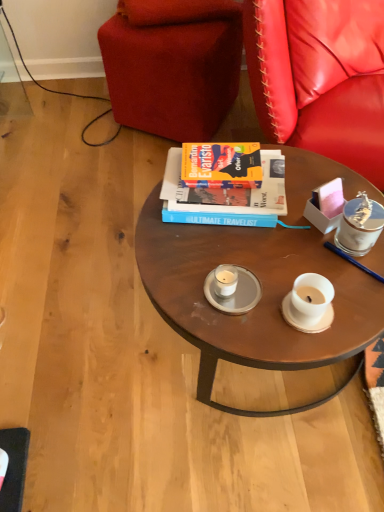
Measure the distance between point (x=236, y=275) and camera.

A distance of 36.97 inches exists between point (x=236, y=275) and camera.

Locate an element on the screen. The image size is (384, 512). wooden round table at center is located at coordinates (259, 301).

Where is `hardcover book at center`? This screenshot has height=512, width=384. hardcover book at center is located at coordinates (227, 190).

You are a GUI agent. You are given a task and a screenshot of the screen. Output one action in this format:
    pyautogui.click(x=<x>, y=<y>)
    Task: Click on the clear glass saucer at center
    The image size is (384, 512).
    Given the screenshot: What is the action you would take?
    pyautogui.click(x=235, y=293)

Is wooden round table at center not close to velvet red studio couch at upper center?

Actually, wooden round table at center and velvet red studio couch at upper center are a little close together.

Is wooden round table at center at the right side of velvet red studio couch at upper center?

Indeed, wooden round table at center is positioned on the right side of velvet red studio couch at upper center.

Is velvet red studio couch at upper center completely or partially inside wooden round table at center?

No.

In the scene shown: Is wooden round table at center facing away from velvet red studio couch at upper center?

Yes, wooden round table at center is positioned with its back facing velvet red studio couch at upper center.

Considering the relative positions of clear glass saucer at center and silver metallic candle at upper right, acting as the second coffee cup starting from the bottom, in the image provided, is clear glass saucer at center in front of silver metallic candle at upper right, acting as the second coffee cup starting from the bottom,?

No, it is not.

Does clear glass saucer at center have a larger size compared to silver metallic candle at upper right, the first coffee cup when ordered from top to bottom?

Incorrect, clear glass saucer at center is not larger than silver metallic candle at upper right, the first coffee cup when ordered from top to bottom.

Is clear glass saucer at center positioned beyond the bounds of silver metallic candle at upper right, the first coffee cup when ordered from top to bottom?

Yes.

From a real-world perspective, is velvet red studio couch at upper center located beneath silver metallic candle at upper right, the first coffee cup when ordered from top to bottom?

Yes, from a real-world perspective, velvet red studio couch at upper center is beneath silver metallic candle at upper right, the first coffee cup when ordered from top to bottom.

Is velvet red studio couch at upper center taller than silver metallic candle at upper right, the first coffee cup when ordered from top to bottom?

Yes, velvet red studio couch at upper center is taller than silver metallic candle at upper right, the first coffee cup when ordered from top to bottom.

Is velvet red studio couch at upper center situated inside silver metallic candle at upper right, the first coffee cup from the right, or outside?

velvet red studio couch at upper center exists outside the volume of silver metallic candle at upper right, the first coffee cup from the right.

Is the depth of velvet red studio couch at upper center less than that of silver metallic candle at upper right, the first coffee cup when ordered from top to bottom?

No, velvet red studio couch at upper center is further to the viewer.

Locate an element on the screen. coffee cup lying on the left of wooden round table at center is located at coordinates (225, 280).

From the picture: Is wooden round table at center looking in the opposite direction of white matte candle at center, which is the second coffee cup from top to bottom?

No, wooden round table at center is not facing away from white matte candle at center, which is the second coffee cup from top to bottom.

Is wooden round table at center positioned before white matte candle at center, acting as the second coffee cup starting from the right?

Yes, the depth of wooden round table at center is less than that of white matte candle at center, acting as the second coffee cup starting from the right.

Is wooden round table at center at the right side of white matte candle at center, marked as the 1th coffee cup in a left-to-right arrangement?

Indeed, wooden round table at center is positioned on the right side of white matte candle at center, marked as the 1th coffee cup in a left-to-right arrangement.

Looking at this image, how much distance is there between clear glass saucer at center and wooden round table at center?

They are 6.78 inches apart.

Is the depth of clear glass saucer at center greater than that of wooden round table at center?

Yes, the depth of clear glass saucer at center is greater than that of wooden round table at center.

From the image's perspective, is clear glass saucer at center on wooden round table at center?

Actually, clear glass saucer at center appears below wooden round table at center in the image.

Is clear glass saucer at center in contact with wooden round table at center?

No, clear glass saucer at center is not with wooden round table at center.

Based on the photo, is hardcover book at center at the back of velvet red studio couch at upper center?

No, velvet red studio couch at upper center is not facing the opposite direction of hardcover book at center.

Does velvet red studio couch at upper center have a lesser height compared to hardcover book at center?

Incorrect, the height of velvet red studio couch at upper center does not fall short of that of hardcover book at center.

From the image's perspective, which is above, velvet red studio couch at upper center or hardcover book at center?

velvet red studio couch at upper center appears higher in the image.

Based on the photo, is velvet red studio couch at upper center with hardcover book at center?

No, velvet red studio couch at upper center is not touching hardcover book at center.

Based on the photo, from a real-world perspective, relative to velvet red studio couch at upper center, is silver metallic candle at upper right, acting as the second coffee cup starting from the bottom, vertically above or below?

silver metallic candle at upper right, acting as the second coffee cup starting from the bottom, is above velvet red studio couch at upper center.

Is point (349, 249) closer or farther from the camera than point (221, 108)?

Point (349, 249) appears to be closer to the viewer than point (221, 108).

Based on the photo, is silver metallic candle at upper right, the first coffee cup when ordered from top to bottom, turned away from velvet red studio couch at upper center?

Yes, silver metallic candle at upper right, the first coffee cup when ordered from top to bottom, is positioned with its back facing velvet red studio couch at upper center.

You are a GUI agent. You are given a task and a screenshot of the screen. Output one action in this format:
    pyautogui.click(x=<x>, y=<y>)
    Task: Click on the coffee table that is on the right side of velvet red studio couch at upper center
    The image size is (384, 512).
    Given the screenshot: What is the action you would take?
    pyautogui.click(x=259, y=301)

Find the location of a particular element. saucer on the left of silver metallic candle at upper right, acting as the second coffee cup starting from the bottom is located at coordinates (235, 293).

Based on their spatial positions, is white matte candle at center, which is the second coffee cup from top to bottom, or silver metallic candle at upper right, the first coffee cup when ordered from top to bottom, closer to velvet red studio couch at upper center?

Based on the image, silver metallic candle at upper right, the first coffee cup when ordered from top to bottom, appears to be nearer to velvet red studio couch at upper center.

Looking at the image, which one is located closer to clear glass saucer at center, velvet red studio couch at upper center or hardcover book at center?

hardcover book at center.

Estimate the real-world distances between objects in this image. Which object is further from white matte candle at center, marked as the 1th coffee cup in a left-to-right arrangement, wooden round table at center or hardcover book at center?

Among the two, hardcover book at center is located further to white matte candle at center, marked as the 1th coffee cup in a left-to-right arrangement.

Based on their spatial positions, is hardcover book at center or silver metallic candle at upper right, acting as the second coffee cup starting from the bottom, further from clear glass saucer at center?

silver metallic candle at upper right, acting as the second coffee cup starting from the bottom, is further to clear glass saucer at center.

Estimate the real-world distances between objects in this image. Which object is closer to velvet red studio couch at upper center, white matte candle at center, marked as the first coffee cup in a bottom-to-top arrangement, or clear glass saucer at center?

white matte candle at center, marked as the first coffee cup in a bottom-to-top arrangement, is closer to velvet red studio couch at upper center.

Which object lies further to the anchor point silver metallic candle at upper right, the first coffee cup when ordered from top to bottom, white matte candle at center, acting as the second coffee cup starting from the right, or clear glass saucer at center?

Based on the image, white matte candle at center, acting as the second coffee cup starting from the right, appears to be further to silver metallic candle at upper right, the first coffee cup when ordered from top to bottom.

Which object lies nearer to the anchor point white matte candle at center, which is the second coffee cup from top to bottom, velvet red studio couch at upper center or wooden round table at center?

wooden round table at center lies closer to white matte candle at center, which is the second coffee cup from top to bottom, than the other object.

When comparing their distances from white matte candle at center, marked as the 1th coffee cup in a left-to-right arrangement, does hardcover book at center or velvet red studio couch at upper center seem further?

Among the two, velvet red studio couch at upper center is located further to white matte candle at center, marked as the 1th coffee cup in a left-to-right arrangement.

This screenshot has width=384, height=512. I want to click on coffee table between hardcover book at center and silver metallic candle at upper right, the first coffee cup when ordered from top to bottom, so click(259, 301).

Image resolution: width=384 pixels, height=512 pixels. What are the coordinates of `book between velvet red studio couch at upper center and wooden round table at center from top to bottom` in the screenshot? It's located at (227, 190).

Where is `book between velvet red studio couch at upper center and silver metallic candle at upper right, acting as the second coffee cup starting from the bottom, vertically`? This screenshot has height=512, width=384. book between velvet red studio couch at upper center and silver metallic candle at upper right, acting as the second coffee cup starting from the bottom, vertically is located at coordinates (227, 190).

Identify the location of saucer between hardcover book at center and silver metallic candle at upper right, which is counted as the 2th coffee cup, starting from the left, from left to right. (235, 293).